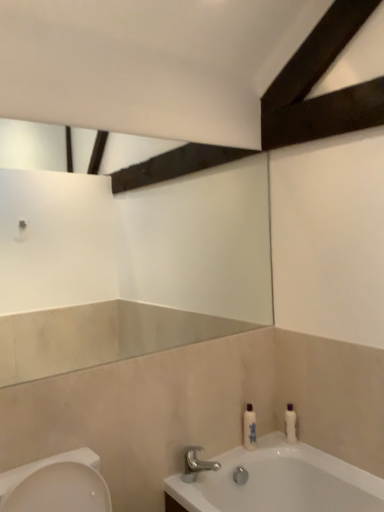
Question: Is point (246, 407) closer or farther from the camera than point (185, 454)?

Choices:
 (A) farther
 (B) closer

Answer: (A)

Question: From the image's perspective, is white glossy bottle at lower right, the first toiletry viewed from the left, above or below polished chrome faucet at lower center?

Choices:
 (A) below
 (B) above

Answer: (B)

Question: Considering the real-world distances, which object is farthest from the white glossy bottle at lower right, positioned as the 2th toiletry in right-to-left order?

Choices:
 (A) polished chrome faucet at lower center
 (B) white glossy bottle at right, arranged as the 2th toiletry when viewed from the left

Answer: (A)

Question: Estimate the real-world distances between objects in this image. Which object is closer to the white glossy bottle at right, acting as the first toiletry starting from the right?

Choices:
 (A) white glossy bottle at lower right, positioned as the 2th toiletry in right-to-left order
 (B) polished chrome faucet at lower center

Answer: (A)